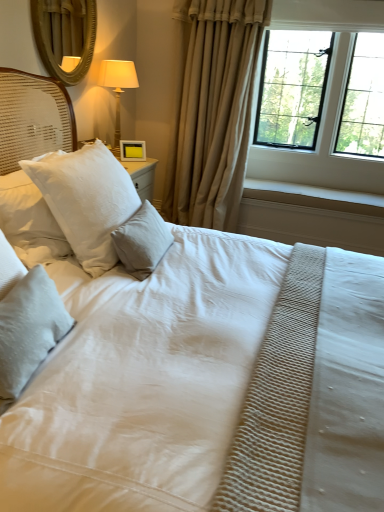
Question: Does matte gold lamp at upper left have a smaller size compared to beige fabric curtain at center?

Choices:
 (A) yes
 (B) no

Answer: (A)

Question: Is matte gold lamp at upper left aimed at beige fabric curtain at center?

Choices:
 (A) yes
 (B) no

Answer: (B)

Question: Does matte gold lamp at upper left have a greater height compared to beige fabric curtain at center?

Choices:
 (A) no
 (B) yes

Answer: (A)

Question: From the image's perspective, is matte gold lamp at upper left below beige fabric curtain at center?

Choices:
 (A) no
 (B) yes

Answer: (A)

Question: From the image's perspective, is matte gold lamp at upper left over beige fabric curtain at center?

Choices:
 (A) no
 (B) yes

Answer: (B)

Question: Is matte gold lamp at upper left closer to the viewer compared to beige fabric curtain at center?

Choices:
 (A) no
 (B) yes

Answer: (A)

Question: Considering the relative sizes of black metal window at upper right and matte gold lamp at upper left in the image provided, is black metal window at upper right wider than matte gold lamp at upper left?

Choices:
 (A) no
 (B) yes

Answer: (B)

Question: Considering the relative sizes of black metal window at upper right and matte gold lamp at upper left in the image provided, is black metal window at upper right shorter than matte gold lamp at upper left?

Choices:
 (A) no
 (B) yes

Answer: (A)

Question: Is black metal window at upper right smaller than matte gold lamp at upper left?

Choices:
 (A) no
 (B) yes

Answer: (A)

Question: Considering the relative sizes of black metal window at upper right and matte gold lamp at upper left in the image provided, is black metal window at upper right thinner than matte gold lamp at upper left?

Choices:
 (A) no
 (B) yes

Answer: (A)

Question: Is black metal window at upper right at the left side of matte gold lamp at upper left?

Choices:
 (A) no
 (B) yes

Answer: (A)

Question: Can you confirm if black metal window at upper right is taller than matte gold lamp at upper left?

Choices:
 (A) no
 (B) yes

Answer: (B)

Question: Is white textured pillow at center, placed as the 3th pillow when sorted from front to back, in contact with white textured pillow at upper left, arranged as the 2th pillow when viewed from the back?

Choices:
 (A) yes
 (B) no

Answer: (B)